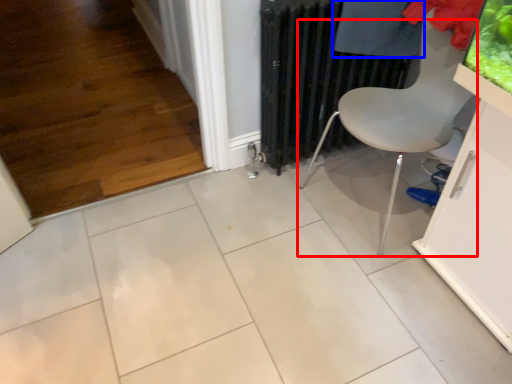
Question: Which point is further to the camera, chair (highlighted by a red box) or clothing (highlighted by a blue box)?

Choices:
 (A) chair
 (B) clothing

Answer: (B)